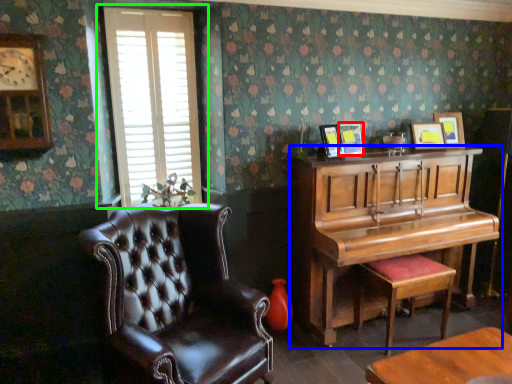
Question: Considering the real-world distances, which object is closest to picture frame (highlighted by a red box)? piano (highlighted by a blue box) or window (highlighted by a green box).

Choices:
 (A) piano
 (B) window

Answer: (A)